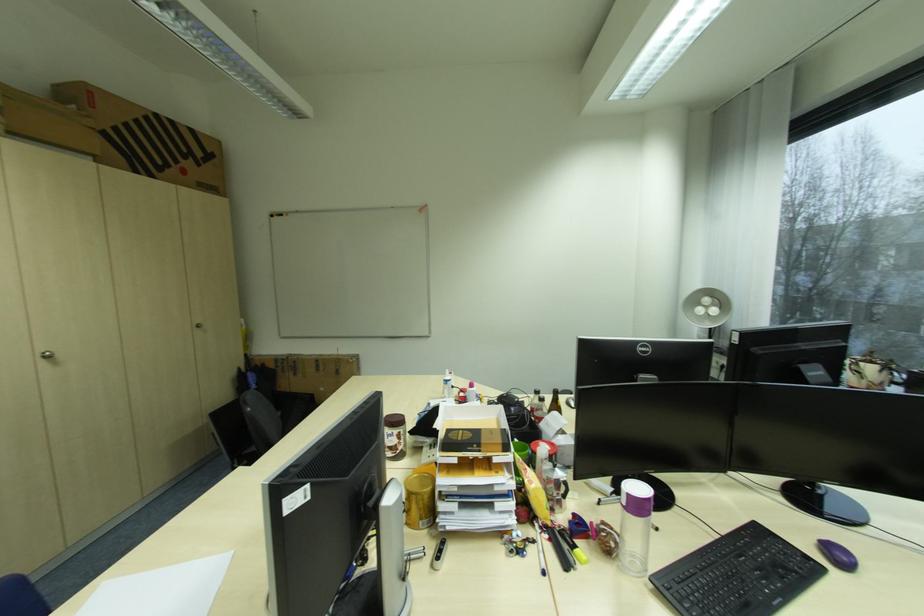
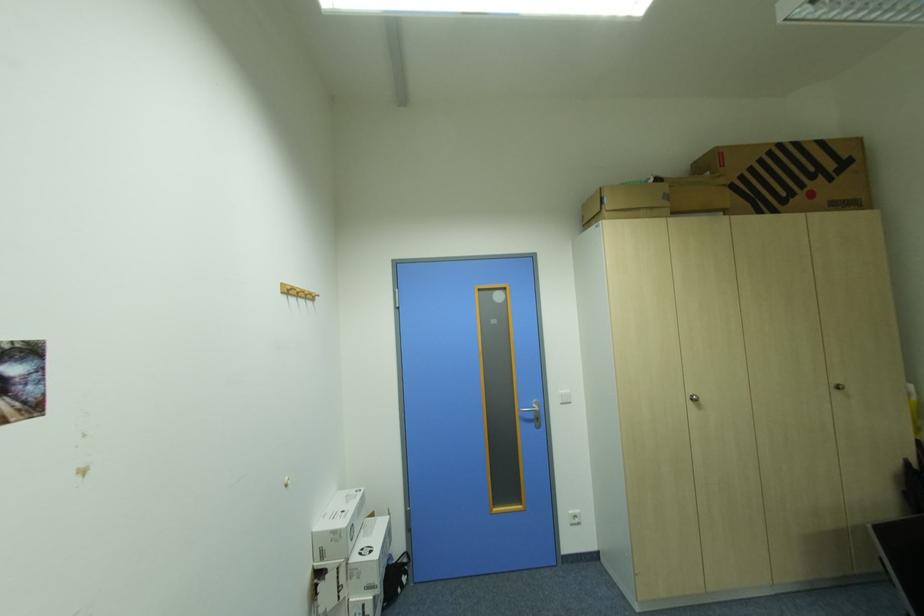
Find the pixel in the second image that matches (152,119) in the first image.

(777, 153)